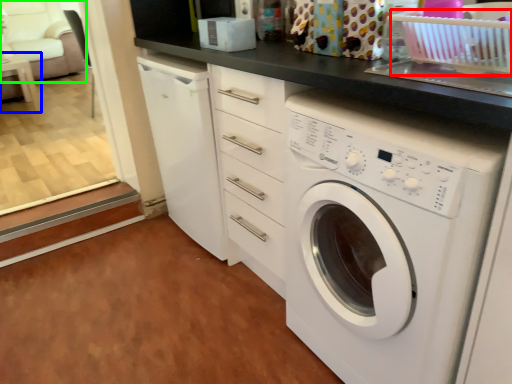
Question: Estimate the real-world distances between objects in this image. Which object is closer to basket (highlighted by a red box), table (highlighted by a blue box) or armchair (highlighted by a green box)?

Choices:
 (A) table
 (B) armchair

Answer: (A)